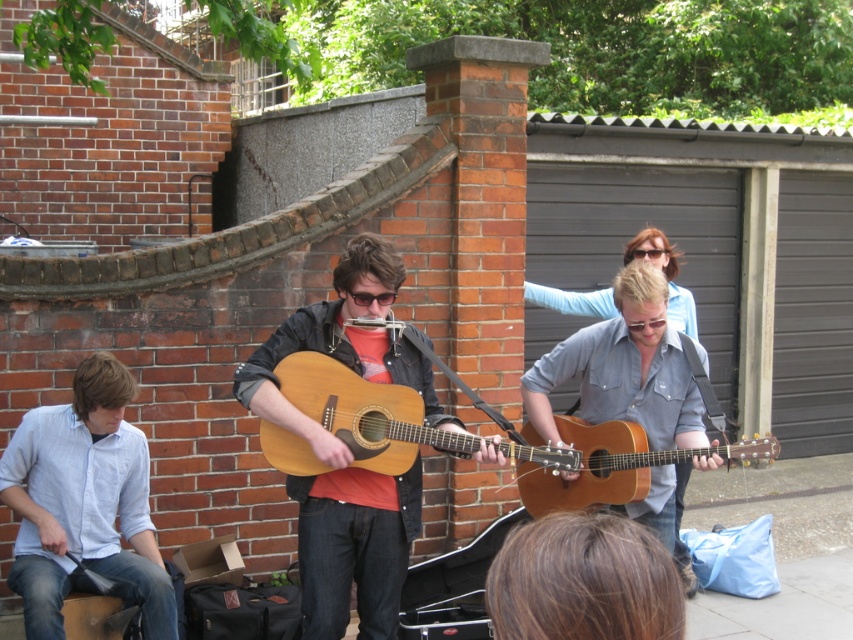
You are a photographer trying to capture a closeup of the natural wood acoustic guitar at center and the matte black sunglasses at center. Based on their positions, which object should you adjust your camera focus to first to ensure both are in frame?

The natural wood acoustic guitar at center is positioned on the right side of matte black sunglasses at center. To capture both in frame, focus on the matte black sunglasses at center first since it is closer to the left, then adjust to include the guitar on its right.

You are a photographer standing at the center of the scene. You want to take a photo that includes both the light blue denim shirt at left and another musician playing an acoustic guitar. Which musician should you focus on to ensure both are in the frame?

The light blue denim shirt at left is located at point [84,504], so you should focus on the musician on the right to include both in the frame.

You are a photographer who wants to capture a clear shot of both the natural wood acoustic guitar at center and the matte black sunglasses at center. Since you want to focus on the instruments, which object should you adjust your camera focus on first?

The natural wood acoustic guitar at center is positioned under matte black sunglasses at center, so you should focus on the natural wood acoustic guitar at center first since it is closer to the camera.